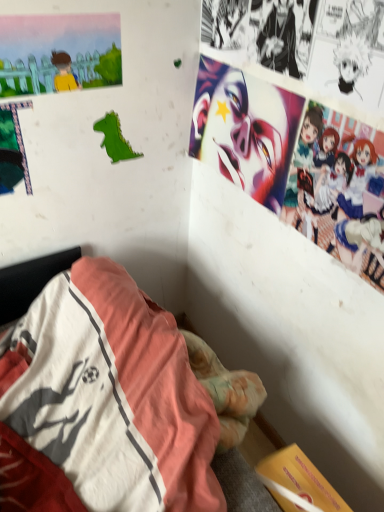
Question: Looking at the image, does green paper dinosaur at upper left seem bigger or smaller compared to vivid matte clown face at upper right?

Choices:
 (A) small
 (B) big

Answer: (A)

Question: Considering the positions of green paper dinosaur at upper left and vivid matte clown face at upper right in the image, is green paper dinosaur at upper left taller or shorter than vivid matte clown face at upper right?

Choices:
 (A) short
 (B) tall

Answer: (A)

Question: Which of these objects is positioned farthest from the vivid matte clown face at upper right?

Choices:
 (A) black paper at upper right, which ranks as the first person in left-to-right order
 (B) green paper dinosaur at upper left
 (C) matte paper painting at upper left, the 2th poster page positioned from the right
 (D) orange matte poster at lower right, the second poster page when ordered from top to bottom
 (E) pastel-colored anime characters at upper right, marked as the second person in a left-to-right arrangement

Answer: (D)

Question: Which is farther from the black paper at upper right, the 1th person positioned from the top?

Choices:
 (A) orange matte poster at lower right, the 2th poster page in the left-to-right sequence
 (B) pastel-colored anime characters at upper right, which ranks as the 1th person in bottom-to-top order
 (C) vivid matte clown face at upper right
 (D) matte paper painting at upper left, the first poster page from the top
 (E) green paper dinosaur at upper left

Answer: (A)